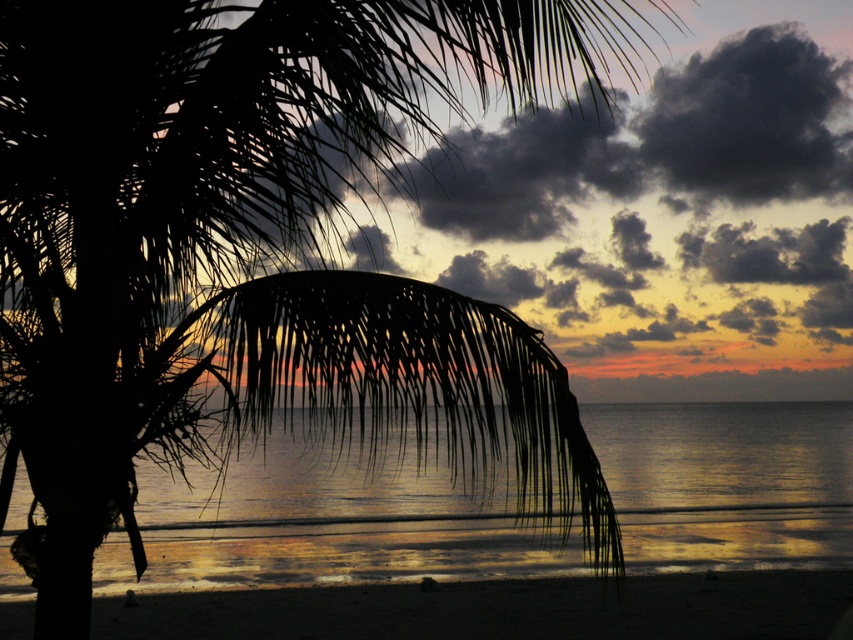
Question: Which object is farther from the camera taking this photo?

Choices:
 (A) sandy beach at lower center
 (B) glistening silver water at center

Answer: (B)

Question: Does glistening silver water at center come in front of sandy beach at lower center?

Choices:
 (A) yes
 (B) no

Answer: (B)

Question: Does glistening silver water at center have a larger size compared to sandy beach at lower center?

Choices:
 (A) no
 (B) yes

Answer: (A)

Question: Does glistening silver water at center have a larger size compared to sandy beach at lower center?

Choices:
 (A) yes
 (B) no

Answer: (B)